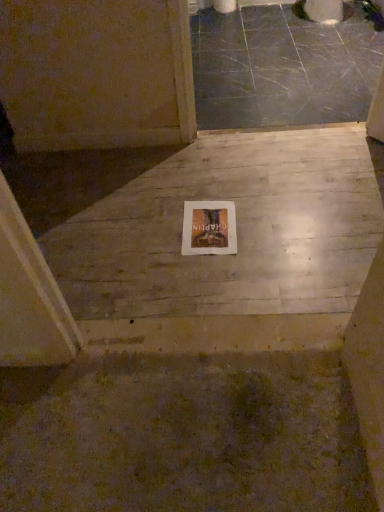
Question: From a real-world perspective, is gray polished concrete at upper center, which is counted as the 2th concrete, starting from the front, physically located above or below wooden book at center?

Choices:
 (A) below
 (B) above

Answer: (B)

Question: Is gray polished concrete at upper center, which is counted as the 2th concrete, starting from the front, taller or shorter than wooden book at center?

Choices:
 (A) tall
 (B) short

Answer: (A)

Question: Estimate the real-world distances between objects in this image. Which object is farther from the white wood floor at center, which is the first concrete from front to back?

Choices:
 (A) wooden book at center
 (B) gray polished concrete at upper center, the 1th concrete from the back

Answer: (B)

Question: Which object is the closest to the wooden book at center?

Choices:
 (A) gray polished concrete at upper center, the 2th concrete when ordered from bottom to top
 (B) white wood floor at center, positioned as the 2th concrete in top-to-bottom order

Answer: (B)